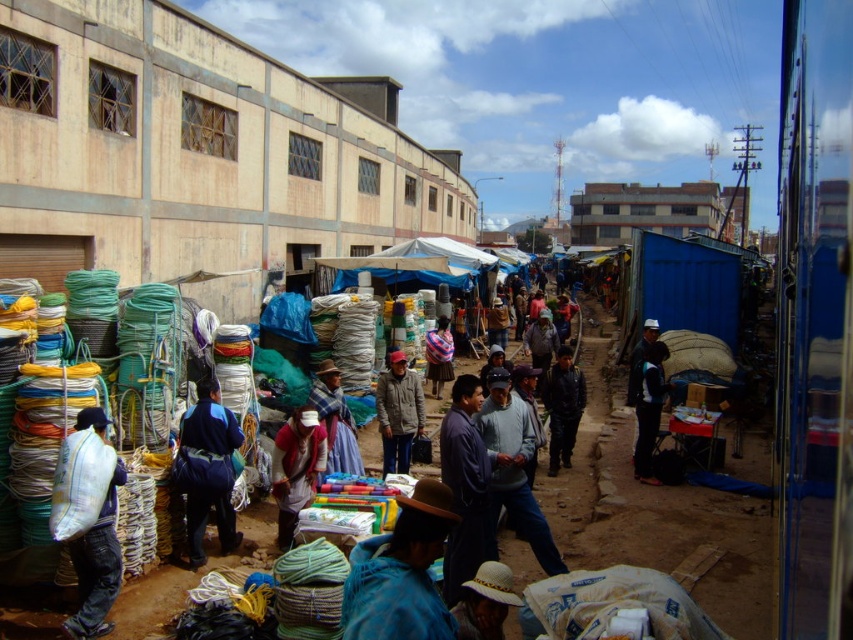
Question: Which object is farther from the camera taking this photo?

Choices:
 (A) white straw hat at lower center
 (B) blue fabric jacket at center
 (C) dark gray jacket at center
 (D) white fabric bag at lower left

Answer: (C)

Question: Considering the relative positions of blue woven fabric at center and striped fabric bag at center in the image provided, where is blue woven fabric at center located with respect to striped fabric bag at center?

Choices:
 (A) below
 (B) above

Answer: (A)

Question: Estimate the real-world distances between objects in this image. Which object is farther from the white straw hat at lower center?

Choices:
 (A) dark blue leather jacket at center
 (B) dark blue fabric jacket at center
 (C) dark gray jacket at center

Answer: (B)

Question: Considering the relative positions of gray wool sweater at center and striped fabric bag at center in the image provided, where is gray wool sweater at center located with respect to striped fabric bag at center?

Choices:
 (A) left
 (B) right

Answer: (B)

Question: Which of the following is the farthest from the observer?

Choices:
 (A) white fabric bag at lower left
 (B) blue woven fabric at center
 (C) dark blue fabric jacket at center
 (D) dark gray jacket at center

Answer: (C)

Question: Can you confirm if gray wool sweater at center is thinner than white straw hat at lower center?

Choices:
 (A) no
 (B) yes

Answer: (A)